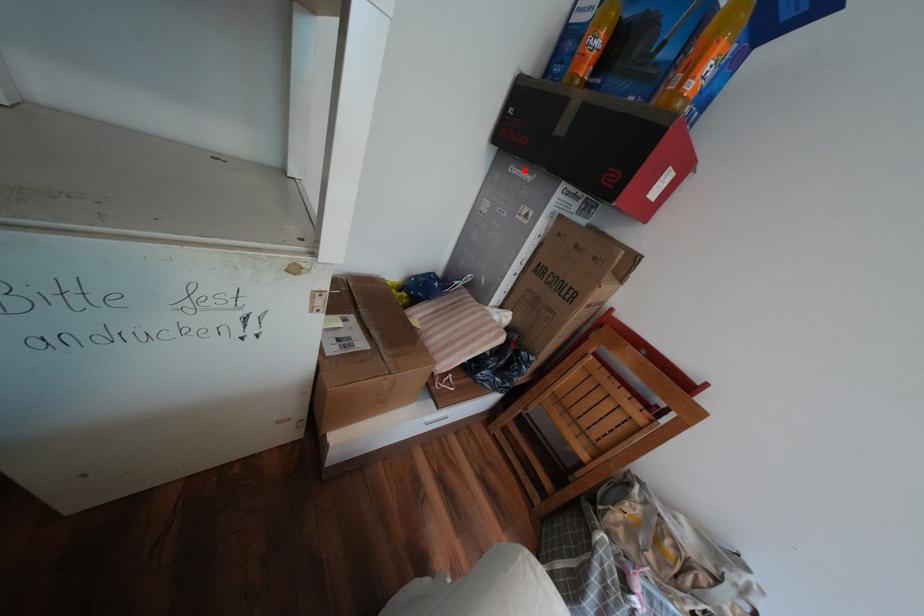
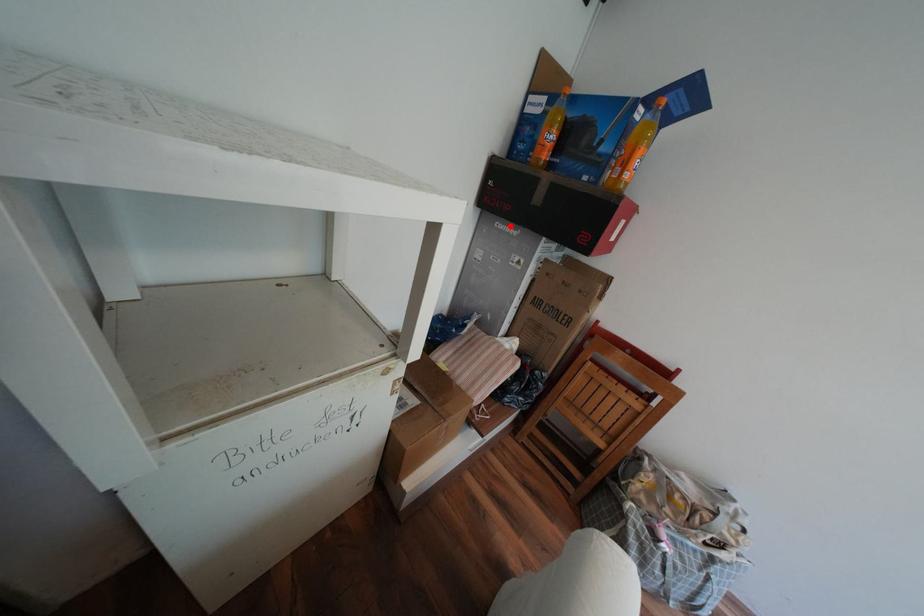
I am providing you with two images of the same scene from different viewpoints. A red point is marked on the first image and another point is marked on the second image. Do the highlighted points in image1 and image2 indicate the same real-world spot?

Yes